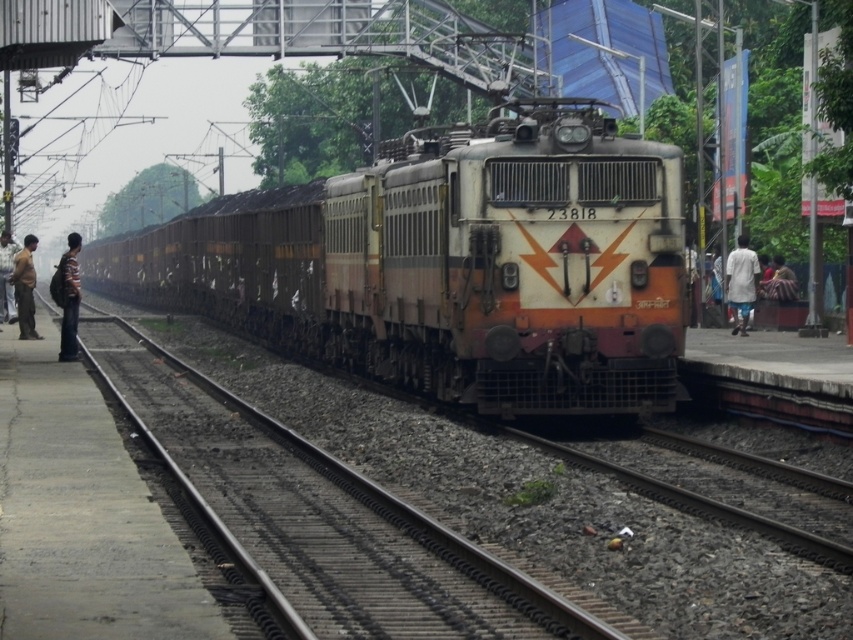
You are a passenger standing on the platform at the railway station. You see the gravel at center and the white cotton shirt at right. Which object is closer to the locomotive with the orange diamond logo?

The gravel at center is closer to the locomotive with the orange diamond logo because it is positioned on the left side of the white cotton shirt at right, meaning the gravel is between the locomotive and the shirt.